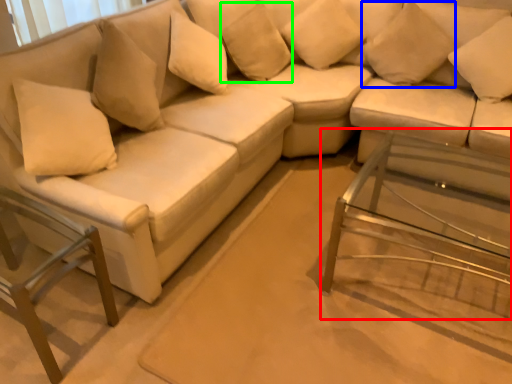
Question: Based on their relative distances, which object is nearer to side table (highlighted by a red box)? Choose from pillow (highlighted by a blue box) and pillow (highlighted by a green box).

Choices:
 (A) pillow
 (B) pillow

Answer: (A)